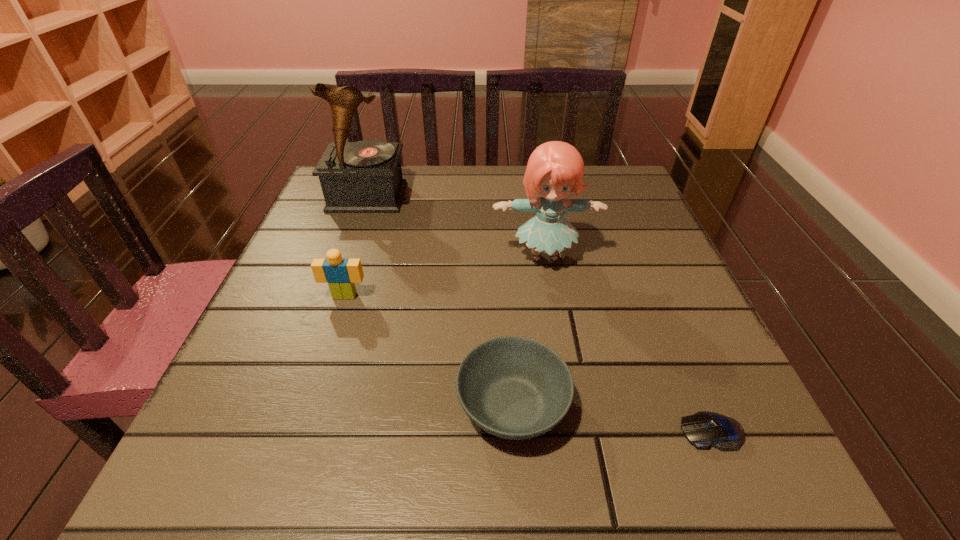
Locate an element on the screen. doll at the right edge is located at coordinates pos(555,168).

I want to click on computer mouse located at the right edge, so click(x=703, y=429).

Identify the location of object at the far left corner. The image size is (960, 540). (365, 176).

I want to click on object that is at the near right corner, so click(703, 429).

Find the location of a particular element. The image size is (960, 540). vacant space at the far edge of the desktop is located at coordinates (460, 214).

In the image, there is a desktop. Identify the location of vacant space at the left edge. (339, 341).

Where is `free location at the right edge of the desktop`? Image resolution: width=960 pixels, height=540 pixels. free location at the right edge of the desktop is located at coordinates (684, 275).

The height and width of the screenshot is (540, 960). What are the coordinates of `free location at the far left corner of the desktop` in the screenshot? It's located at point(320,216).

The width and height of the screenshot is (960, 540). I want to click on free space at the far right corner, so click(x=642, y=210).

This screenshot has height=540, width=960. I want to click on free space at the near right corner, so click(659, 456).